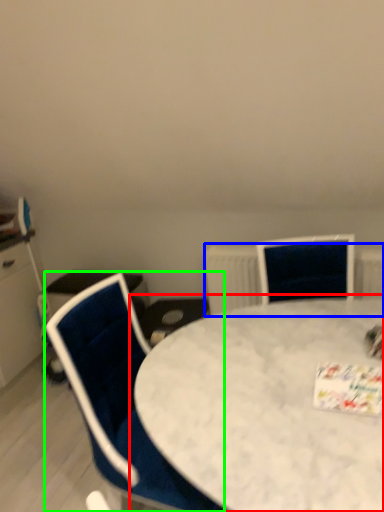
Question: Which object is positioned closest to table (highlighted by a red box)? Select from radiator (highlighted by a blue box) and chair (highlighted by a green box).

Choices:
 (A) radiator
 (B) chair

Answer: (B)